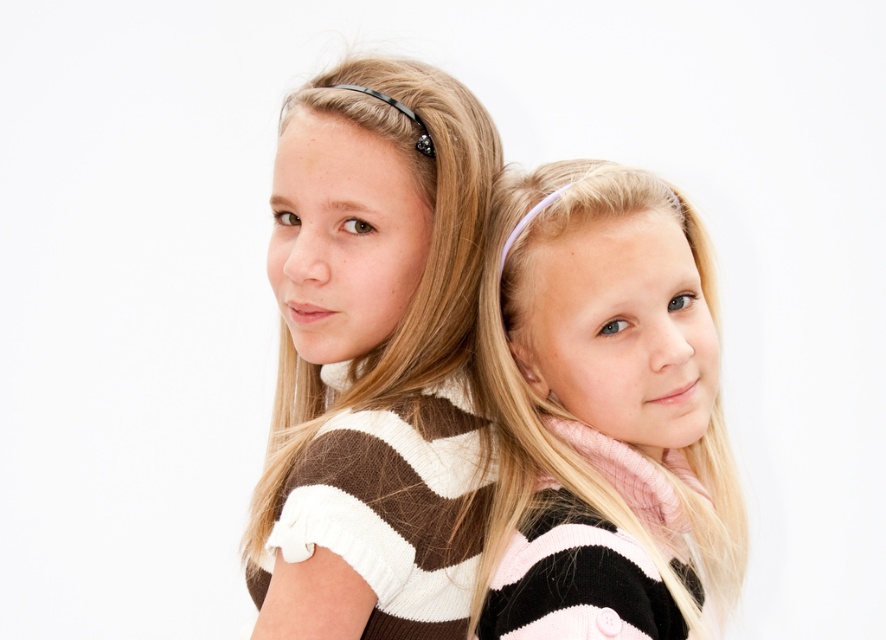
Question: Which of the following is the farthest from the observer?

Choices:
 (A) (444, 630)
 (B) (616, 531)

Answer: (A)

Question: Is brown striped sweater at center bigger than pink striped sweater at center?

Choices:
 (A) no
 (B) yes

Answer: (B)

Question: Which object is farther from the camera taking this photo?

Choices:
 (A) brown striped sweater at center
 (B) pink striped sweater at center

Answer: (A)

Question: Does brown striped sweater at center appear under pink striped sweater at center?

Choices:
 (A) no
 (B) yes

Answer: (A)

Question: Among these points, which one is farthest from the camera?

Choices:
 (A) pyautogui.click(x=502, y=349)
 (B) pyautogui.click(x=317, y=342)

Answer: (B)

Question: Does brown striped sweater at center appear over pink striped sweater at center?

Choices:
 (A) yes
 (B) no

Answer: (A)